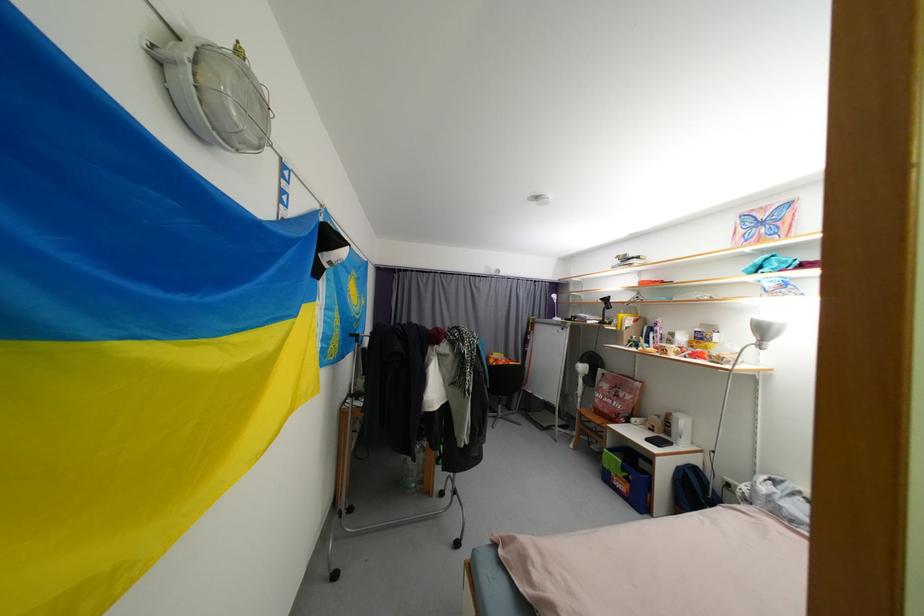
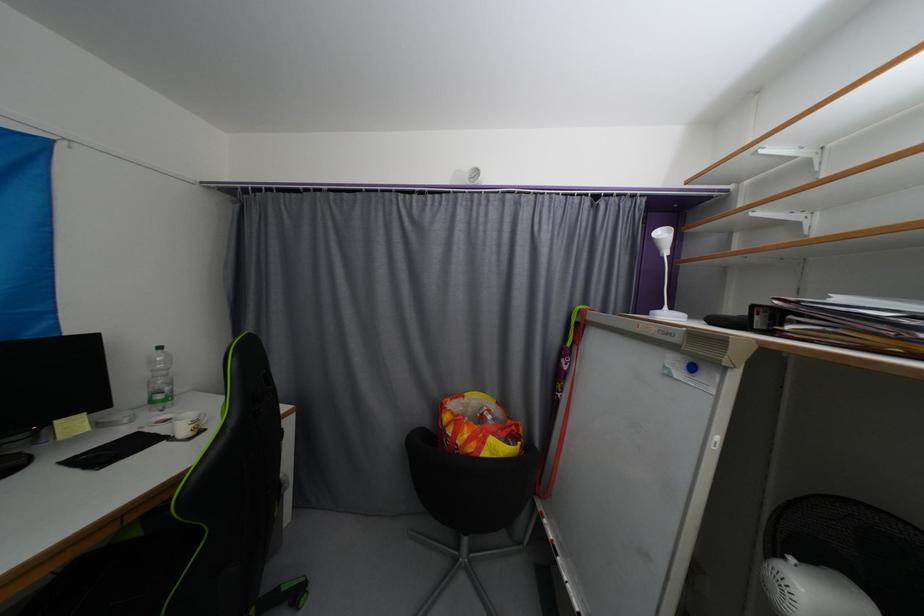
In a continuous first-person perspective shot, in which direction is the camera moving?

The cameraman walked toward right, forward.